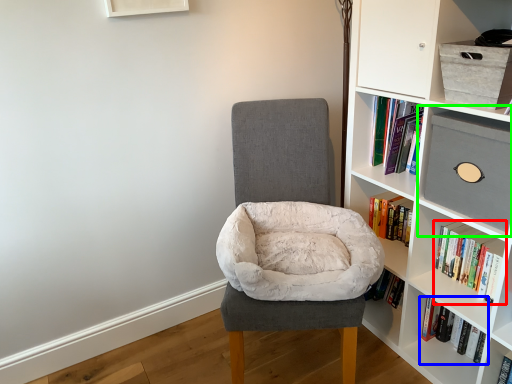
Question: Which is farther away from book (highlighted by a red box)? book (highlighted by a blue box) or shelf (highlighted by a green box)?

Choices:
 (A) book
 (B) shelf

Answer: (B)